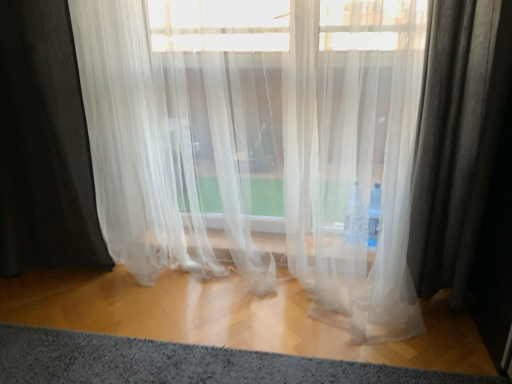
Locate an element on the screen. The width and height of the screenshot is (512, 384). vacant space in translucent white curtain at center (from a real-world perspective) is located at coordinates (249, 294).